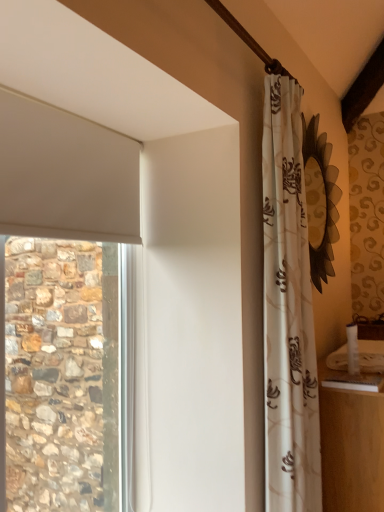
The height and width of the screenshot is (512, 384). Find the location of `floral-patterned fabric curtain at right`. floral-patterned fabric curtain at right is located at coordinates (288, 311).

Measure the distance between point (272, 101) and camera.

The distance of point (272, 101) from camera is 4.98 feet.

The image size is (384, 512). What do you see at coordinates (288, 311) in the screenshot?
I see `floral-patterned fabric curtain at right` at bounding box center [288, 311].

Describe the element at coordinates (353, 381) in the screenshot. This screenshot has height=512, width=384. I see `white glossy counter top at lower right` at that location.

At what (x,y) coordinates should I click in order to perform the action: click on white glossy counter top at lower right. Please return your answer as a coordinate pair (x, y). Looking at the image, I should click on 353,381.

Locate an element on the screen. This screenshot has height=512, width=384. floral-patterned fabric curtain at right is located at coordinates (288, 311).

Considering the positions of objects floral-patterned fabric curtain at right and white glossy counter top at lower right in the image provided, who is more to the right, floral-patterned fabric curtain at right or white glossy counter top at lower right?

From the viewer's perspective, white glossy counter top at lower right appears more on the right side.

Relative to white glossy counter top at lower right, is floral-patterned fabric curtain at right in front or behind?

Clearly, floral-patterned fabric curtain at right is in front of white glossy counter top at lower right.

Considering the points (306, 430) and (364, 373), which point is in front, point (306, 430) or point (364, 373)?

The point (306, 430) is closer.

From the image's perspective, between floral-patterned fabric curtain at right and white glossy counter top at lower right, who is located below?

white glossy counter top at lower right, from the image's perspective.

Consider the image. From a real-world perspective, between floral-patterned fabric curtain at right and white glossy counter top at lower right, who is vertically higher?

From a 3D spatial view, floral-patterned fabric curtain at right is above.

Based on the photo, can you confirm if floral-patterned fabric curtain at right is wider than white glossy counter top at lower right?

No, floral-patterned fabric curtain at right is not wider than white glossy counter top at lower right.

Which of these two, floral-patterned fabric curtain at right or white glossy counter top at lower right, stands taller?

Standing taller between the two is floral-patterned fabric curtain at right.

In terms of size, does floral-patterned fabric curtain at right appear bigger or smaller than white glossy counter top at lower right?

Clearly, floral-patterned fabric curtain at right is larger in size than white glossy counter top at lower right.

Is white glossy counter top at lower right surrounded by floral-patterned fabric curtain at right?

No, white glossy counter top at lower right is not inside floral-patterned fabric curtain at right.

Would you consider floral-patterned fabric curtain at right to be distant from white glossy counter top at lower right?

No, floral-patterned fabric curtain at right is not far away from white glossy counter top at lower right.

Is floral-patterned fabric curtain at right aimed at white glossy counter top at lower right?

Yes, floral-patterned fabric curtain at right is oriented towards white glossy counter top at lower right.

How many degrees apart are the facing directions of floral-patterned fabric curtain at right and white glossy counter top at lower right?

There is a 0.996-degree angle between the facing directions of floral-patterned fabric curtain at right and white glossy counter top at lower right.

You are a GUI agent. You are given a task and a screenshot of the screen. Output one action in this format:
    pyautogui.click(x=<x>, y=<y>)
    Task: Click on the counter top on the right of floral-patterned fabric curtain at right
    This screenshot has width=384, height=512.
    Given the screenshot: What is the action you would take?
    pyautogui.click(x=353, y=381)

Is white glossy counter top at lower right to the left of floral-patterned fabric curtain at right from the viewer's perspective?

Incorrect, white glossy counter top at lower right is not on the left side of floral-patterned fabric curtain at right.

Which is behind, white glossy counter top at lower right or floral-patterned fabric curtain at right?

Positioned behind is white glossy counter top at lower right.

Which is farther, (336, 371) or (280, 227)?

Point (336, 371)

From the image's perspective, is white glossy counter top at lower right on floral-patterned fabric curtain at right?

Actually, white glossy counter top at lower right appears below floral-patterned fabric curtain at right in the image.

From a real-world perspective, relative to floral-patterned fabric curtain at right, is white glossy counter top at lower right vertically above or below?

From a real-world perspective, white glossy counter top at lower right is physically below floral-patterned fabric curtain at right.

Considering the relative sizes of white glossy counter top at lower right and floral-patterned fabric curtain at right in the image provided, is white glossy counter top at lower right wider than floral-patterned fabric curtain at right?

Yes, white glossy counter top at lower right is wider than floral-patterned fabric curtain at right.

Consider the image. Between white glossy counter top at lower right and floral-patterned fabric curtain at right, which one has more height?

Standing taller between the two is floral-patterned fabric curtain at right.

Considering the sizes of objects white glossy counter top at lower right and floral-patterned fabric curtain at right in the image provided, who is smaller, white glossy counter top at lower right or floral-patterned fabric curtain at right?

Smaller between the two is white glossy counter top at lower right.

Looking at this image, is white glossy counter top at lower right completely or partially outside of floral-patterned fabric curtain at right?

white glossy counter top at lower right is positioned outside floral-patterned fabric curtain at right.

Is white glossy counter top at lower right with floral-patterned fabric curtain at right?

No, white glossy counter top at lower right is not touching floral-patterned fabric curtain at right.

Could you tell me if white glossy counter top at lower right is turned towards floral-patterned fabric curtain at right?

No, white glossy counter top at lower right does not turn towards floral-patterned fabric curtain at right.

The image size is (384, 512). Identify the location of counter top behind the floral-patterned fabric curtain at right. (353, 381).

The height and width of the screenshot is (512, 384). Find the location of `curtain above the white glossy counter top at lower right (from the image's perspective)`. curtain above the white glossy counter top at lower right (from the image's perspective) is located at coordinates (288, 311).

This screenshot has height=512, width=384. Identify the location of curtain located above the white glossy counter top at lower right (from a real-world perspective). (288, 311).